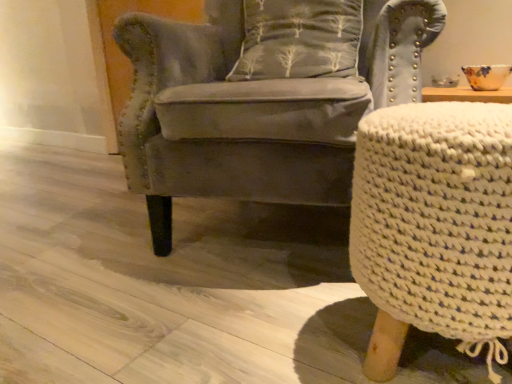
At what (x,y) coordinates should I click in order to perform the action: click on gray fabric pillow with tree pattern at center. Please return your answer as a coordinate pair (x, y). Looking at the image, I should click on [x=298, y=39].

Locate an element on the screen. The image size is (512, 384). velvet gray armchair at center is located at coordinates click(x=262, y=98).

This screenshot has width=512, height=384. Identify the location of white knitted stool at right. (434, 227).

Can you see white knitted stool at right touching gray fabric pillow with tree pattern at center?

No.

From a real-world perspective, is white knitted stool at right above or below gray fabric pillow with tree pattern at center?

Clearly, from a real-world perspective, white knitted stool at right is below gray fabric pillow with tree pattern at center.

Considering the points (383, 282) and (245, 61), which point is behind, point (383, 282) or point (245, 61)?

Positioned behind is point (245, 61).

Is gray fabric pillow with tree pattern at center surrounded by white knitted stool at right?

Definitely not — gray fabric pillow with tree pattern at center is not inside white knitted stool at right.

Does white knitted stool at right turn towards velvet gray armchair at center?

No, white knitted stool at right does not turn towards velvet gray armchair at center.

Can you confirm if white knitted stool at right is positioned to the left of velvet gray armchair at center?

No, white knitted stool at right is not to the left of velvet gray armchair at center.

Does white knitted stool at right come behind velvet gray armchair at center?

No, it is in front of velvet gray armchair at center.

How much distance is there between white knitted stool at right and velvet gray armchair at center?

A distance of 15.98 inches exists between white knitted stool at right and velvet gray armchair at center.

Based on the photo, is gray fabric pillow with tree pattern at center taller than white knitted stool at right?

In fact, gray fabric pillow with tree pattern at center may be shorter than white knitted stool at right.

Locate an element on the screen. The width and height of the screenshot is (512, 384). table located in front of the gray fabric pillow with tree pattern at center is located at coordinates (434, 227).

Which object is further away from the camera, gray fabric pillow with tree pattern at center or white knitted stool at right?

gray fabric pillow with tree pattern at center is behind.

How many degrees apart are the facing directions of velvet gray armchair at center and white knitted stool at right?

23.7 degrees separate the facing orientations of velvet gray armchair at center and white knitted stool at right.

Does velvet gray armchair at center have a greater width compared to white knitted stool at right?

Correct, the width of velvet gray armchair at center exceeds that of white knitted stool at right.

Which object is further away from the camera, velvet gray armchair at center or white knitted stool at right?

velvet gray armchair at center is behind.

Are velvet gray armchair at center and white knitted stool at right far apart?

velvet gray armchair at center is near white knitted stool at right, not far away.

Which is in front, velvet gray armchair at center or gray fabric pillow with tree pattern at center?

velvet gray armchair at center is more forward.

Consider the image. Considering the sizes of objects velvet gray armchair at center and gray fabric pillow with tree pattern at center in the image provided, who is thinner, velvet gray armchair at center or gray fabric pillow with tree pattern at center?

gray fabric pillow with tree pattern at center is thinner.

Can you confirm if velvet gray armchair at center is positioned to the right of gray fabric pillow with tree pattern at center?

No, velvet gray armchair at center is not to the right of gray fabric pillow with tree pattern at center.

How many degrees apart are the facing directions of velvet gray armchair at center and gray fabric pillow with tree pattern at center?

velvet gray armchair at center and gray fabric pillow with tree pattern at center are facing 1.63 degrees away from each other.

Consider the image. From a real-world perspective, is gray fabric pillow with tree pattern at center positioned over velvet gray armchair at center based on gravity?

Correct, in the physical world, gray fabric pillow with tree pattern at center is higher than velvet gray armchair at center.

Which of these two, gray fabric pillow with tree pattern at center or velvet gray armchair at center, stands taller?

velvet gray armchair at center is taller.

This screenshot has height=384, width=512. I want to click on chair below the gray fabric pillow with tree pattern at center (from the image's perspective), so click(x=262, y=98).

Is velvet gray armchair at center surrounded by gray fabric pillow with tree pattern at center?

No, velvet gray armchair at center is not inside gray fabric pillow with tree pattern at center.

I want to click on pillow above the white knitted stool at right (from a real-world perspective), so click(x=298, y=39).

Find the location of a particular element. table to the right of velvet gray armchair at center is located at coordinates (434, 227).

Based on their spatial positions, is gray fabric pillow with tree pattern at center or velvet gray armchair at center further from white knitted stool at right?

Based on the image, gray fabric pillow with tree pattern at center appears to be further to white knitted stool at right.

Which object lies nearer to the anchor point gray fabric pillow with tree pattern at center, velvet gray armchair at center or white knitted stool at right?

velvet gray armchair at center.

Looking at the image, which one is located closer to velvet gray armchair at center, gray fabric pillow with tree pattern at center or white knitted stool at right?

Among the two, gray fabric pillow with tree pattern at center is located nearer to velvet gray armchair at center.

Considering their positions, is white knitted stool at right positioned further to velvet gray armchair at center than gray fabric pillow with tree pattern at center?

The object further to velvet gray armchair at center is white knitted stool at right.

Estimate the real-world distances between objects in this image. Which object is closer to white knitted stool at right, velvet gray armchair at center or gray fabric pillow with tree pattern at center?

velvet gray armchair at center is closer to white knitted stool at right.

Looking at the image, which one is located closer to gray fabric pillow with tree pattern at center, white knitted stool at right or velvet gray armchair at center?

The object closer to gray fabric pillow with tree pattern at center is velvet gray armchair at center.

The width and height of the screenshot is (512, 384). Find the location of `chair located between white knitted stool at right and gray fabric pillow with tree pattern at center in the depth direction`. chair located between white knitted stool at right and gray fabric pillow with tree pattern at center in the depth direction is located at coordinates (262, 98).